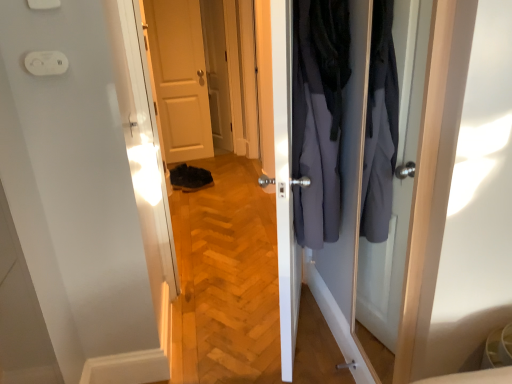
What are the coordinates of `free space in front of matte white door at center` in the screenshot? It's located at (189, 163).